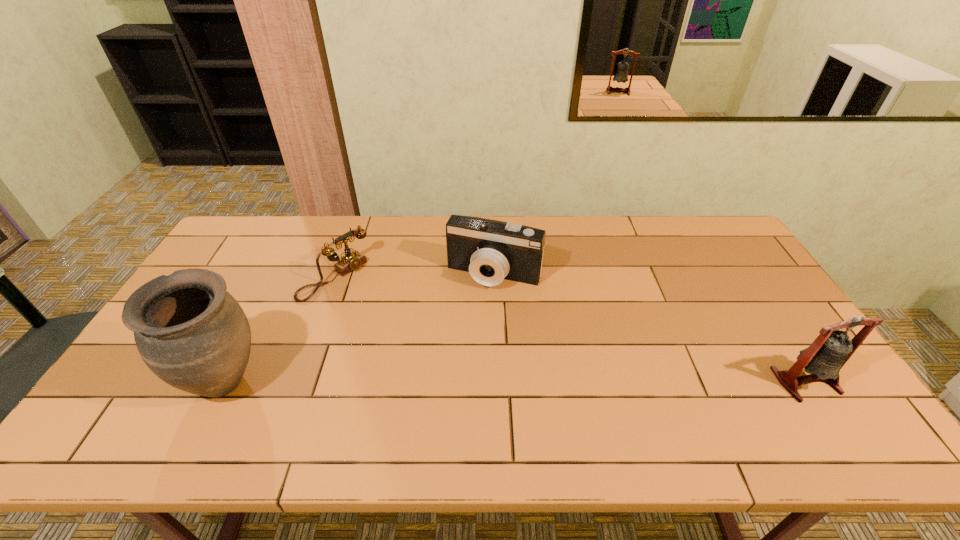
Where is `vacant space on the desktop that is between the tallest object and the bell and is positioned on the lens of the second object from right to left`? The height and width of the screenshot is (540, 960). vacant space on the desktop that is between the tallest object and the bell and is positioned on the lens of the second object from right to left is located at coordinates (450, 381).

This screenshot has width=960, height=540. What are the coordinates of `vacant spot on the desktop that is between the tallest object and the bell and is positioned on the front-facing side of the shortest object` in the screenshot? It's located at (476, 381).